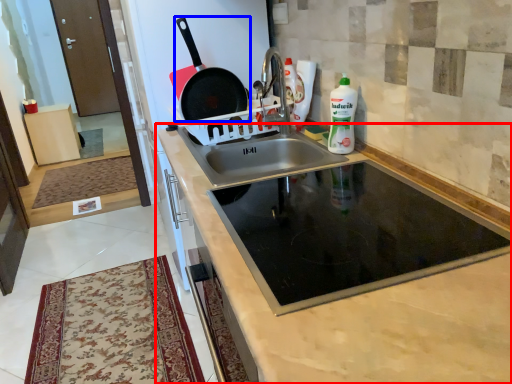
Question: Which of the following is the farthest to the observer, cabinetry (highlighted by a red box) or frying pan (highlighted by a blue box)?

Choices:
 (A) cabinetry
 (B) frying pan

Answer: (B)